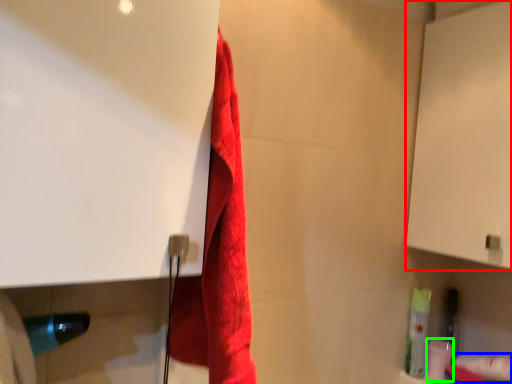
Question: Which is farther away from screen door (highlighted by a red box)? toilet paper (highlighted by a blue box) or toilet paper (highlighted by a green box)?

Choices:
 (A) toilet paper
 (B) toilet paper

Answer: (B)